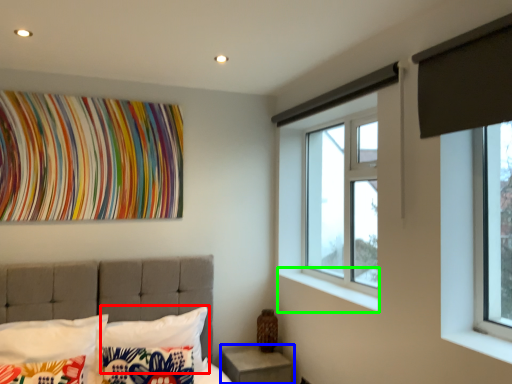
Question: Which object is positioned farthest from pillow (highlighted by a red box)? Select from nightstand (highlighted by a blue box) and window sill (highlighted by a green box).

Choices:
 (A) nightstand
 (B) window sill

Answer: (B)